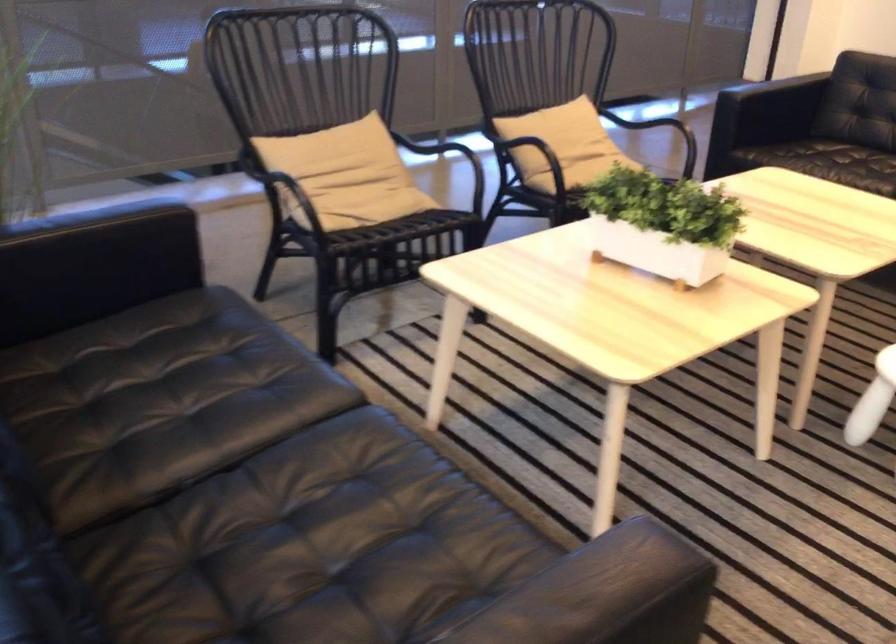
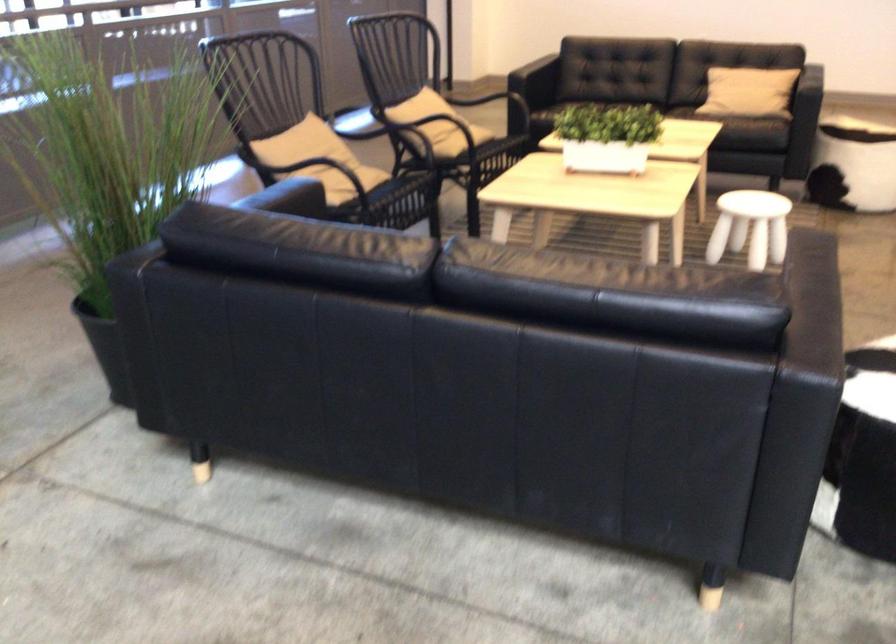
Locate, in the second image, the point that corresponds to point (536, 129) in the first image.

(431, 111)